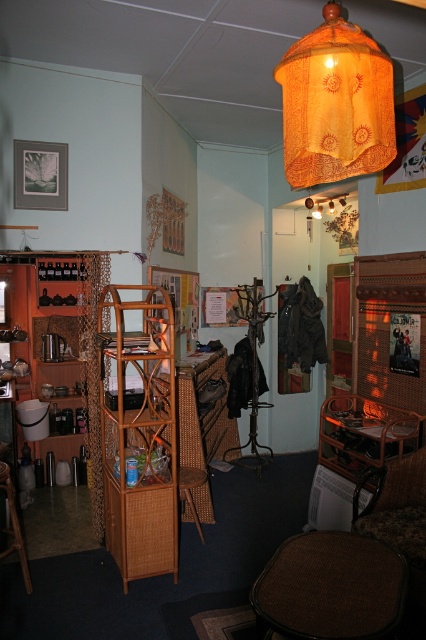
Question: Can you confirm if orange fabric lampshade at upper center is positioned below brown woven chair at lower right?

Choices:
 (A) yes
 (B) no

Answer: (B)

Question: Which object appears farthest from the camera in this image?

Choices:
 (A) orange fabric lampshade at upper center
 (B) woven wicker chair at lower right
 (C) woven rattan shelf at left

Answer: (B)

Question: Does woven rattan shelf at left have a greater width compared to brown fabric stool at lower center?

Choices:
 (A) yes
 (B) no

Answer: (B)

Question: Which of the following is the closest to the observer?

Choices:
 (A) (344, 465)
 (B) (25, 586)

Answer: (B)

Question: Among these points, which one is farthest from the camera?

Choices:
 (A) (333, 202)
 (B) (412, 483)

Answer: (A)

Question: Does brown fabric stool at lower center appear on the right side of brown woven stool at lower left?

Choices:
 (A) no
 (B) yes

Answer: (B)